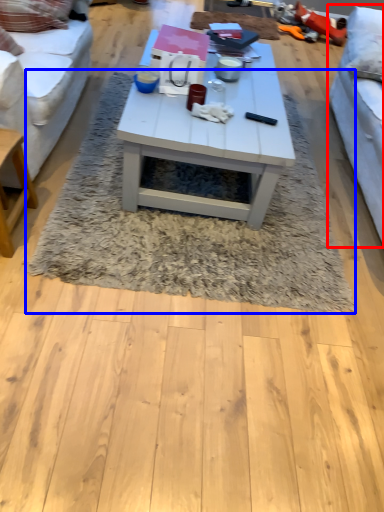
Question: Which object appears closest to the camera in this image, studio couch (highlighted by a red box) or mat (highlighted by a blue box)?

Choices:
 (A) studio couch
 (B) mat

Answer: (A)